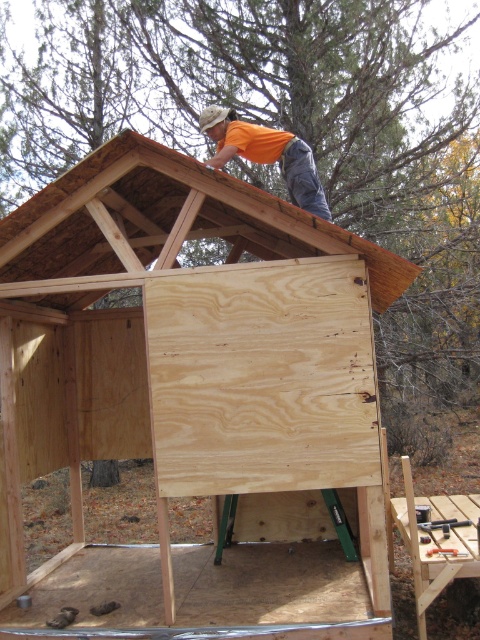
You are an inspector checking the construction site. You notice two pieces of plywood at upper center and plywoodwoodenpanel at center. Which one has a greater width?

The plywood at upper center has a greater width than the plywoodwoodenpanel at center.

You are a construction worker standing on the ground looking at the structure. Which object is closer to you between the plywood at upper center and the brown wood at upper center?

The plywood at upper center is closer to you because the brown wood at upper center is behind it.